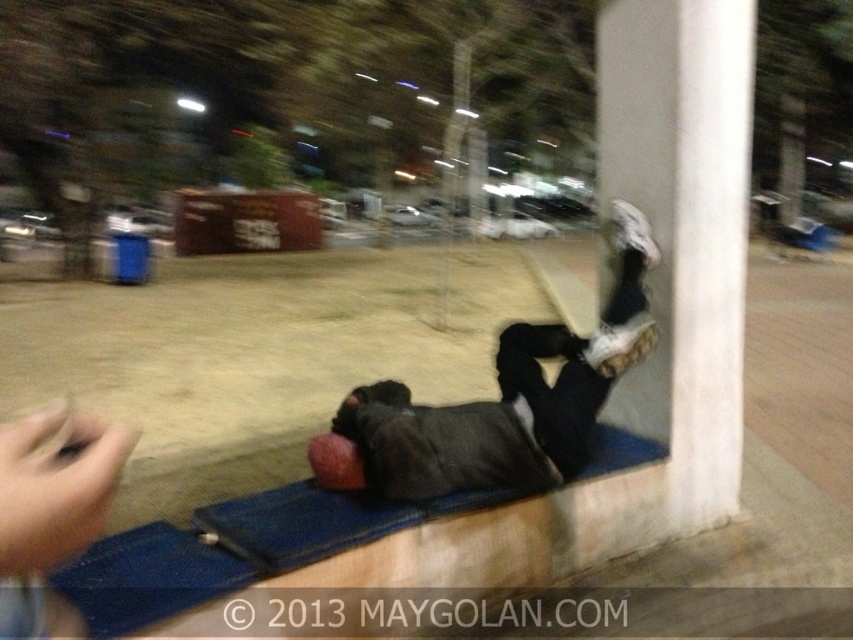
Question: Is white smooth pillar at upper right above dark gray fabric at lower right?

Choices:
 (A) no
 (B) yes

Answer: (B)

Question: Can you confirm if white smooth pillar at upper right is positioned above dark gray fabric at lower right?

Choices:
 (A) yes
 (B) no

Answer: (A)

Question: Which of the following is the farthest from the observer?

Choices:
 (A) dark gray fabric at lower right
 (B) white smooth pillar at upper right

Answer: (B)

Question: Is white smooth pillar at upper right to the left of dark gray fabric at lower right from the viewer's perspective?

Choices:
 (A) yes
 (B) no

Answer: (B)